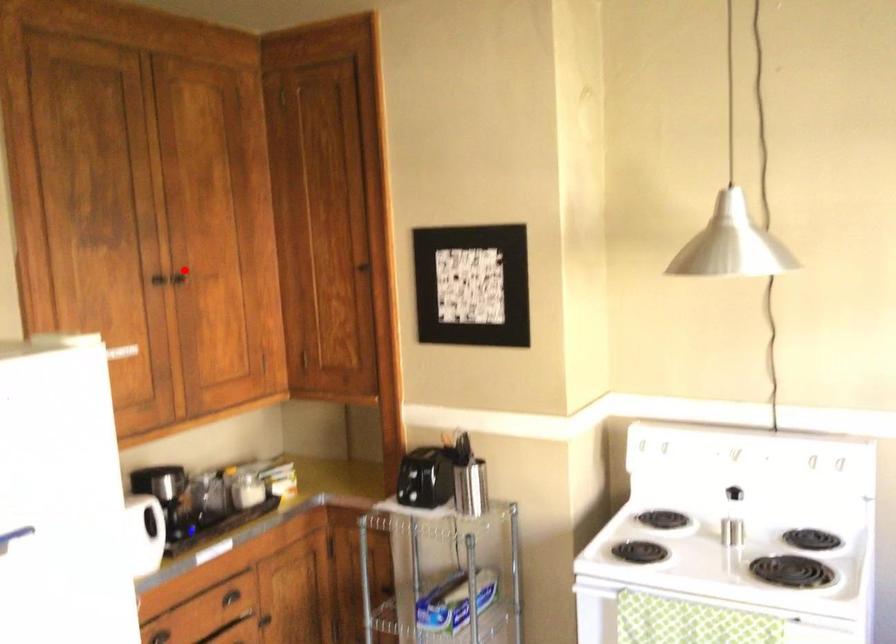
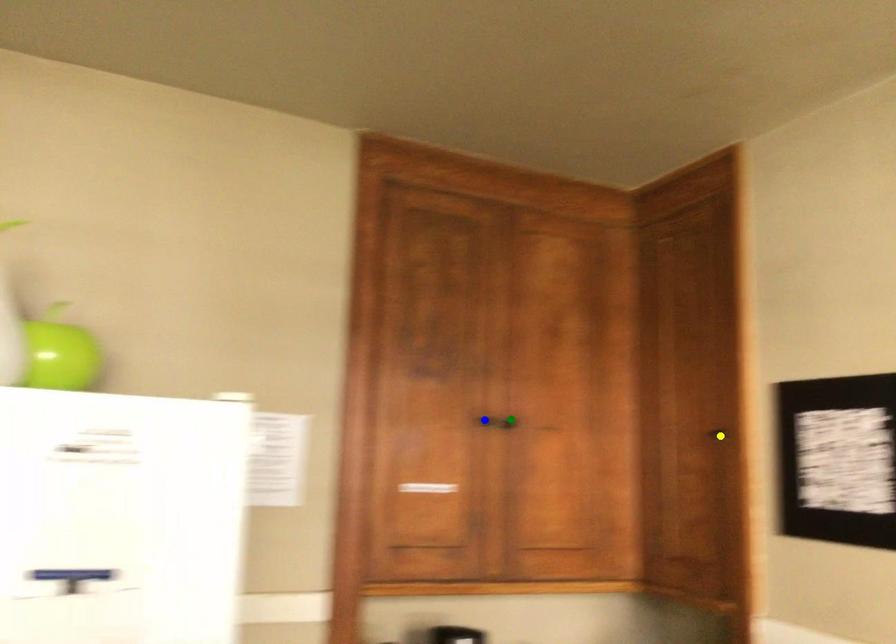
Question: I am providing you with two images of the same scene from different viewpoints. A red point is marked on the first image. You are given multiple points on the second image. Which point in image 2 is actually the same real-world point as the red point in image 1?

Choices:
 (A) yellow point
 (B) green point
 (C) blue point

Answer: (B)